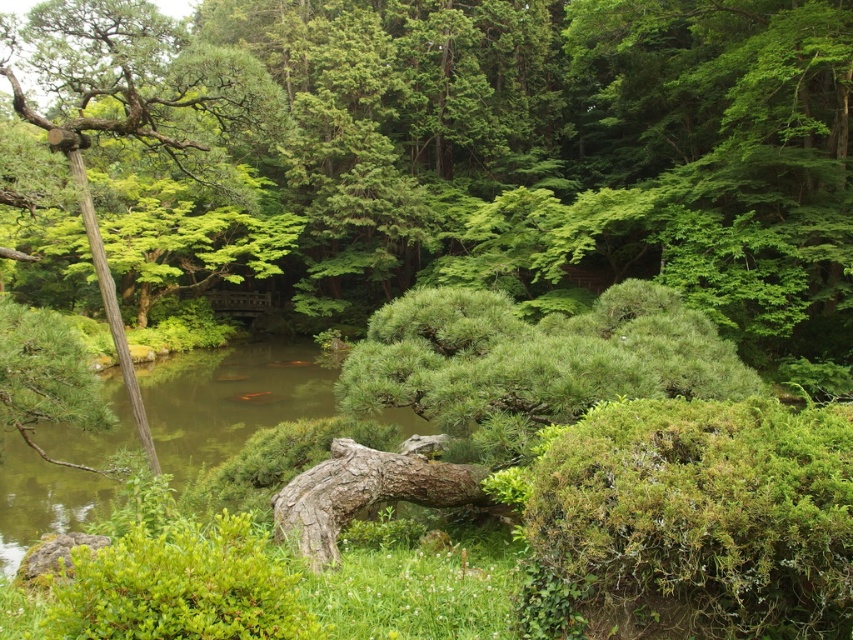
Question: Is green mossy bush at lower right bigger than green leafy tree at left?

Choices:
 (A) no
 (B) yes

Answer: (A)

Question: Which point is farther to the camera?

Choices:
 (A) green leafy tree at left
 (B) green mossy bush at lower right

Answer: (A)

Question: Does green mossy bush at lower right appear on the left side of green leafy tree at left?

Choices:
 (A) yes
 (B) no

Answer: (B)

Question: Can you confirm if green mossy bush at lower right is positioned to the right of green leafy tree at left?

Choices:
 (A) yes
 (B) no

Answer: (A)

Question: Which point is closer to the camera taking this photo?

Choices:
 (A) (x=759, y=433)
 (B) (x=184, y=140)

Answer: (A)